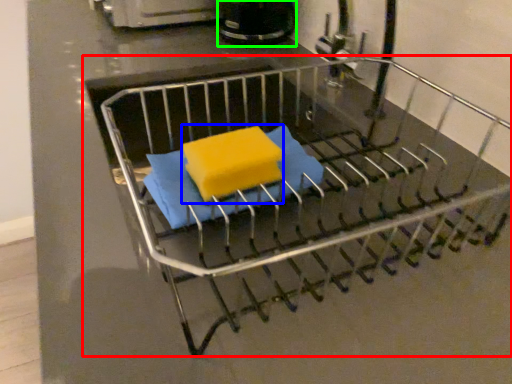
Question: Which object is the closest to the furniture (highlighted by a red box)? Choose among these: cheese (highlighted by a blue box) or appliance (highlighted by a green box).

Choices:
 (A) cheese
 (B) appliance

Answer: (A)